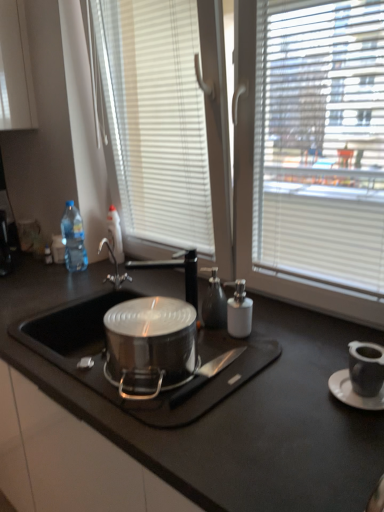
Question: Is black matte tap at center taller than glossy ceramic mug at upper right?

Choices:
 (A) no
 (B) yes

Answer: (B)

Question: Can you confirm if black matte tap at center is positioned to the right of glossy ceramic mug at upper right?

Choices:
 (A) no
 (B) yes

Answer: (A)

Question: Is the position of black matte tap at center more distant than that of glossy ceramic mug at upper right?

Choices:
 (A) no
 (B) yes

Answer: (B)

Question: From a real-world perspective, is black matte tap at center beneath glossy ceramic mug at upper right?

Choices:
 (A) yes
 (B) no

Answer: (B)

Question: Considering the relative sizes of black matte tap at center and glossy ceramic mug at upper right in the image provided, is black matte tap at center thinner than glossy ceramic mug at upper right?

Choices:
 (A) no
 (B) yes

Answer: (A)

Question: Does black matte tap at center have a lesser height compared to glossy ceramic mug at upper right?

Choices:
 (A) no
 (B) yes

Answer: (A)

Question: Would you say black matte countertop at center is a long distance from white ceramic saucer at lower right?

Choices:
 (A) yes
 (B) no

Answer: (B)

Question: Is black matte countertop at center taller than white ceramic saucer at lower right?

Choices:
 (A) yes
 (B) no

Answer: (A)

Question: Is black matte countertop at center at the left side of white ceramic saucer at lower right?

Choices:
 (A) no
 (B) yes

Answer: (B)

Question: From the image's perspective, is black matte countertop at center below white ceramic saucer at lower right?

Choices:
 (A) yes
 (B) no

Answer: (A)

Question: Does black matte countertop at center have a lesser height compared to white ceramic saucer at lower right?

Choices:
 (A) yes
 (B) no

Answer: (B)

Question: Are black matte countertop at center and white ceramic saucer at lower right making contact?

Choices:
 (A) no
 (B) yes

Answer: (A)

Question: From a real-world perspective, is black matte tap at center physically above black matte countertop at center?

Choices:
 (A) yes
 (B) no

Answer: (A)